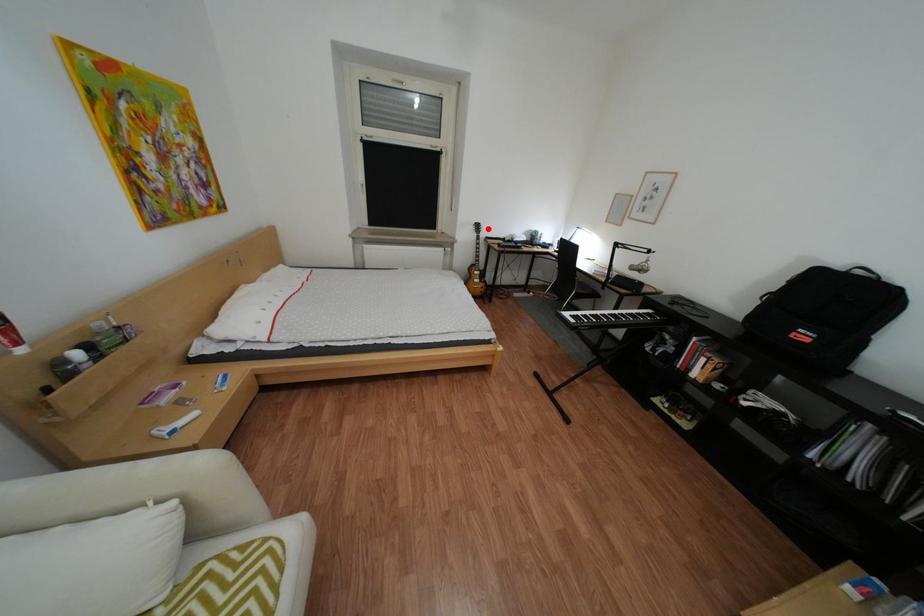
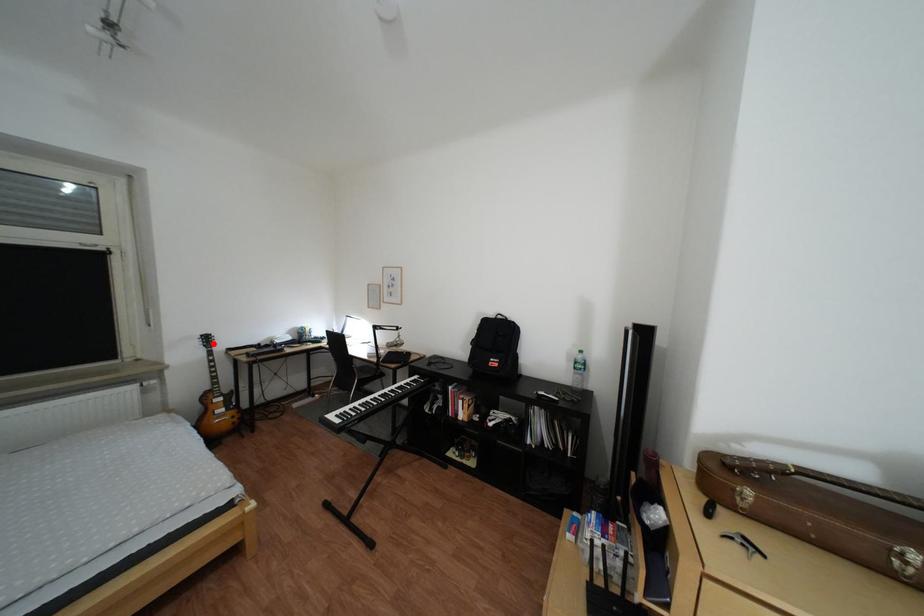
I am providing you with two images of the same scene from different viewpoints. A red point is marked on the first image and another point is marked on the second image. Is the red point in image1 aligned with the point shown in image2?

Yes